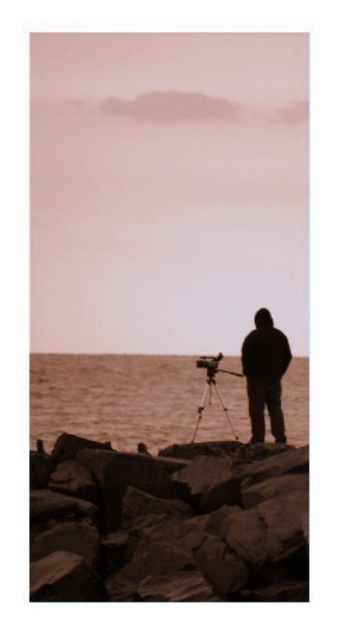
You are a photographer trying to set up your equipment on the shore. The rusty stone rocks at lower center are located at coordinates point 0.817, 0.497. Can you confirm if this location is suitable for placing your tripod?

The rusty stone rocks at lower center are positioned at point [168,522], which is a suitable location for placing your tripod as the rocks provide a stable surface.

You are a photographer standing on the rocky shore and want to adjust your camera setup. The rusty stone rocks at lower center and the black matte jacket at center are in your view. Which object is closer to you, the photographer?

The rusty stone rocks at lower center are closer to you since they are positioned in front of the black matte jacket at center.